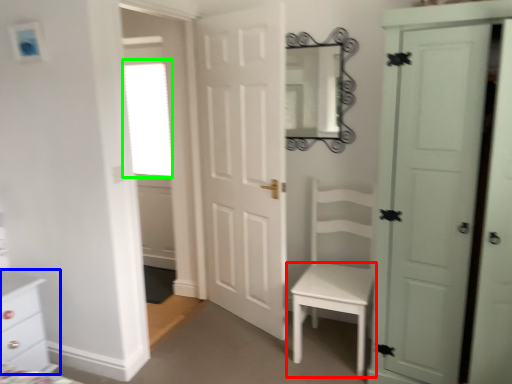
Question: Which object is the farthest from table (highlighted by a red box)? Choose among these: chest of drawers (highlighted by a blue box) or window (highlighted by a green box).

Choices:
 (A) chest of drawers
 (B) window

Answer: (B)